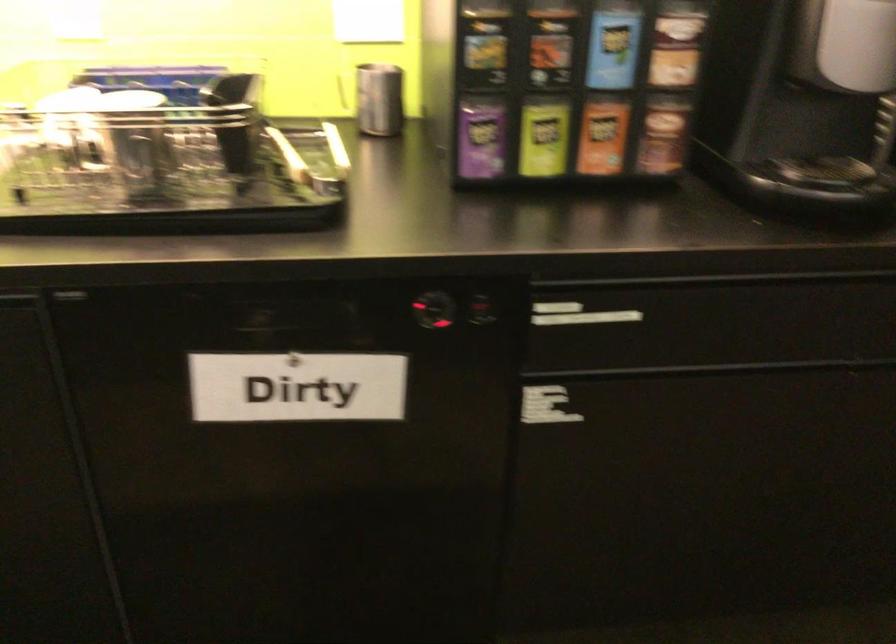
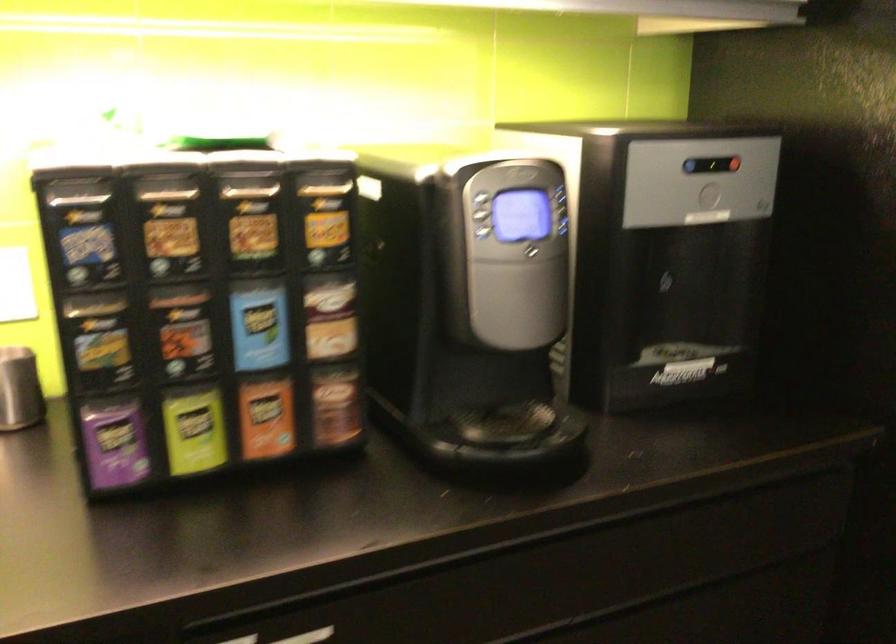
In the second image, find the point that corresponds to pixel 478 138 in the first image.

(114, 442)